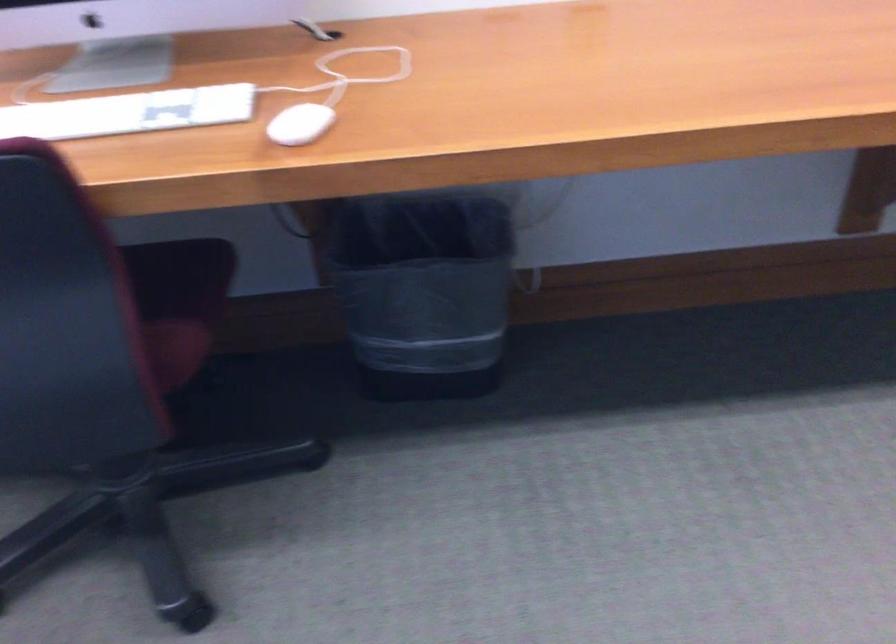
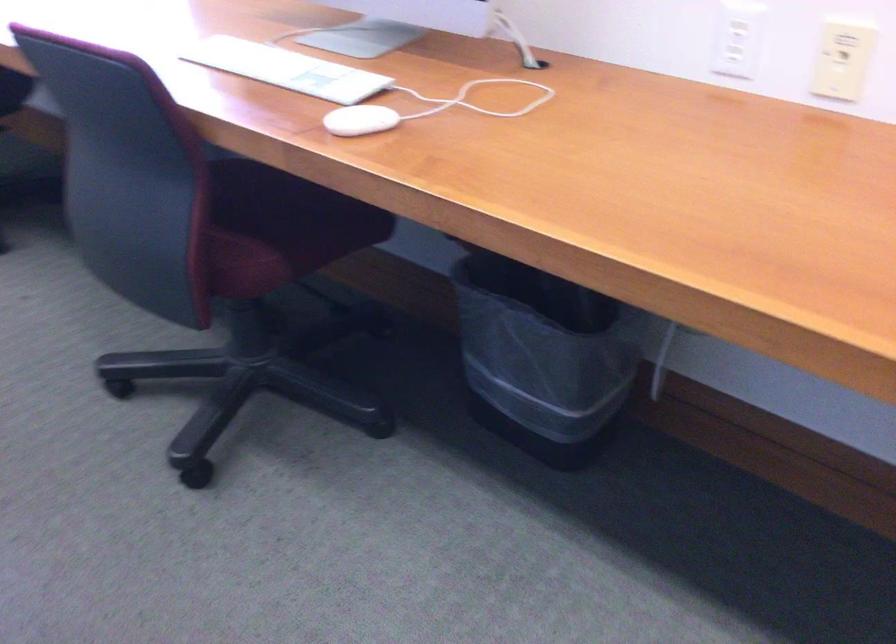
Find the pixel in the second image that matches (x=157, y=299) in the first image.

(273, 228)